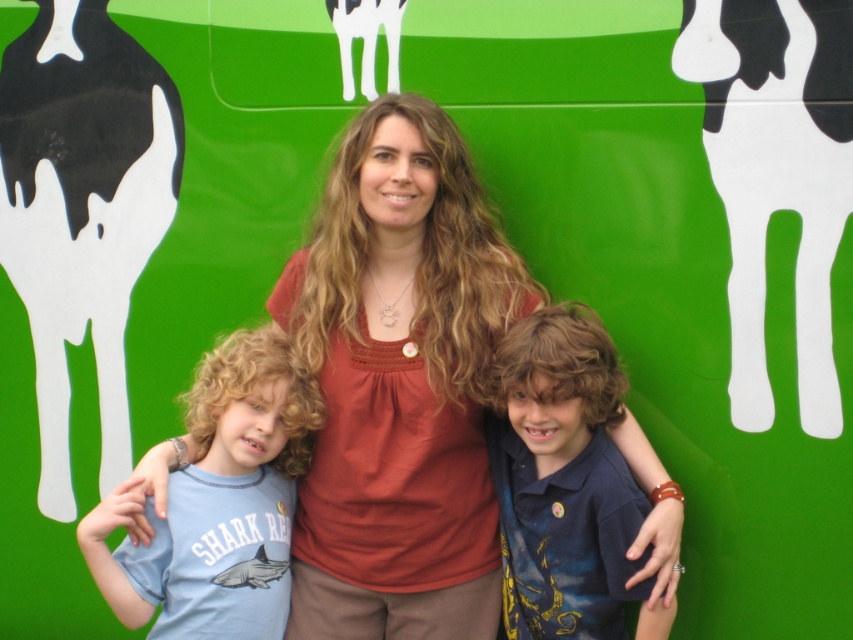
Question: Which object is closer to the camera taking this photo?

Choices:
 (A) blue cotton shirt at center
 (B) light blue cotton t-shirt at left
 (C) matte brown blouse at center
 (D) black glossy cow at left

Answer: (A)

Question: Is matte brown blouse at center above blue cotton shirt at center?

Choices:
 (A) no
 (B) yes

Answer: (B)

Question: Where is matte brown blouse at center located in relation to light blue cotton t-shirt at left in the image?

Choices:
 (A) above
 (B) below

Answer: (A)

Question: Is black glossy cow at upper right bigger than blue cotton shirt at center?

Choices:
 (A) no
 (B) yes

Answer: (A)

Question: Which point is closer to the camera?

Choices:
 (A) (415, 438)
 (B) (585, 573)

Answer: (B)

Question: Which object is the farthest from the light blue cotton t-shirt at left?

Choices:
 (A) black glossy cow at upper right
 (B) black glossy cow at left
 (C) matte brown blouse at center

Answer: (A)